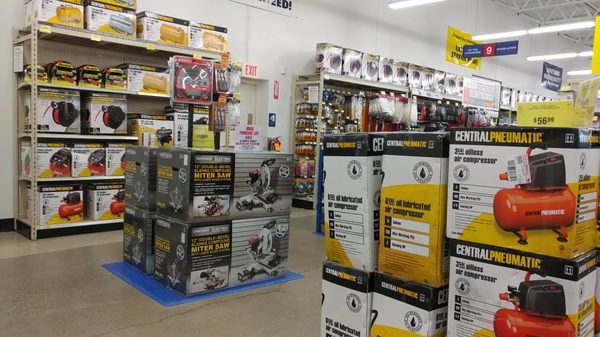
At what (x,y) coordinates should I click in order to perform the action: click on white wall. Please return your answer as a coordinate pair (x, y). Looking at the image, I should click on (276, 31).